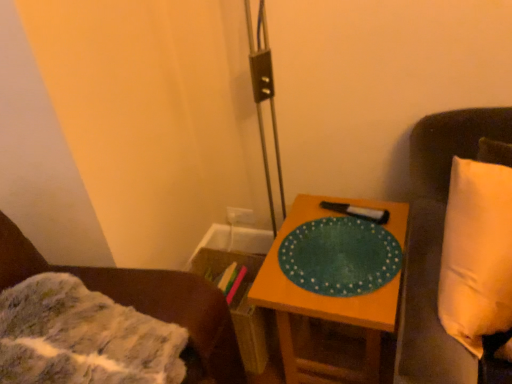
This screenshot has width=512, height=384. In order to click on free spot above green matte platter at center-right (from a real-world perspective) in this screenshot , I will do `click(340, 248)`.